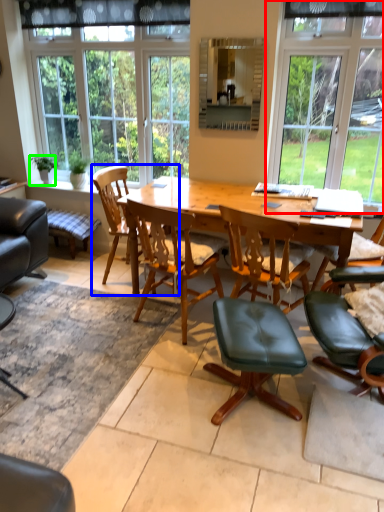
Question: Considering the real-world distances, which object is farthest from window (highlighted by a red box)? chair (highlighted by a blue box) or houseplant (highlighted by a green box)?

Choices:
 (A) chair
 (B) houseplant

Answer: (B)